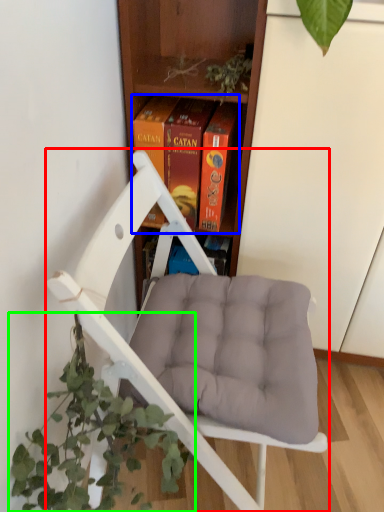
Question: Which object is positioned closest to chair (highlighted by a red box)? Select from book (highlighted by a blue box) and houseplant (highlighted by a green box).

Choices:
 (A) book
 (B) houseplant

Answer: (B)